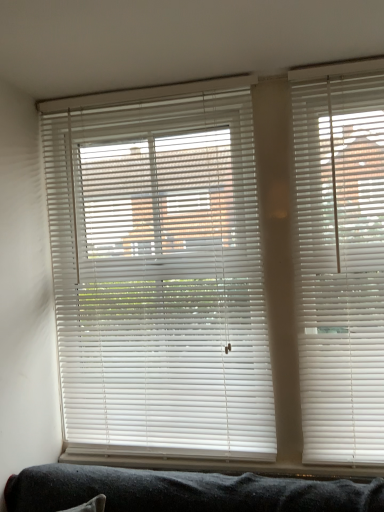
Question: Considering the positions of white plastic blinds at right, marked as the second window blind in a left-to-right arrangement, and white matte blinds at center, which is counted as the 1th window blind, starting from the back, in the image, is white plastic blinds at right, marked as the second window blind in a left-to-right arrangement, bigger or smaller than white matte blinds at center, which is counted as the 1th window blind, starting from the back,?

Choices:
 (A) small
 (B) big

Answer: (A)

Question: Is white plastic blinds at right, the 1th window blind when ordered from right to left, taller or shorter than white matte blinds at center, the 1th window blind in the left-to-right sequence?

Choices:
 (A) short
 (B) tall

Answer: (A)

Question: From a real-world perspective, is white plastic blinds at right, the 1th window blind when ordered from right to left, above or below white matte blinds at center, which is counted as the 1th window blind, starting from the back?

Choices:
 (A) above
 (B) below

Answer: (B)

Question: From a real-world perspective, is white matte blinds at center, which is counted as the 1th window blind, starting from the back, positioned above or below white plastic blinds at right, marked as the second window blind in a left-to-right arrangement?

Choices:
 (A) below
 (B) above

Answer: (B)

Question: Visually, is white matte blinds at center, which is counted as the 1th window blind, starting from the back, positioned to the left or to the right of white plastic blinds at right, the 1th window blind viewed from the front?

Choices:
 (A) left
 (B) right

Answer: (A)

Question: Is white matte blinds at center, which is counted as the 1th window blind, starting from the back, spatially inside white plastic blinds at right, the 1th window blind viewed from the front, or outside of it?

Choices:
 (A) outside
 (B) inside

Answer: (A)

Question: From their relative heights in the image, would you say white matte blinds at center, which ranks as the second window blind in front-to-back order, is taller or shorter than white plastic blinds at right, the 1th window blind when ordered from right to left?

Choices:
 (A) tall
 (B) short

Answer: (A)